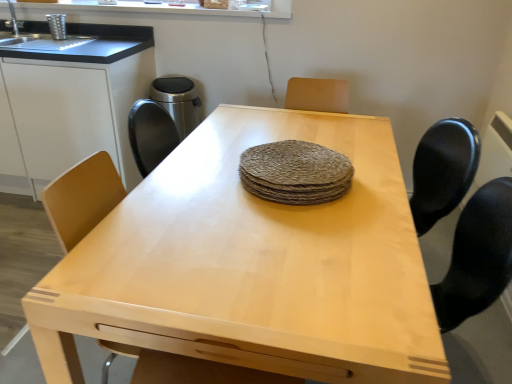
Locate an element on the screen. empty space that is ontop of light wood table at center is located at coordinates (282, 202).